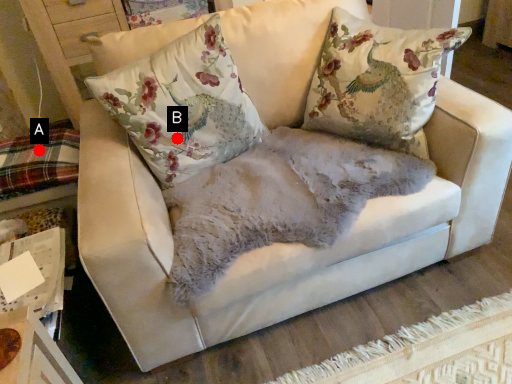
Question: Two points are circled on the image, labeled by A and B beside each circle. Which point is closer to the camera taking this photo?

Choices:
 (A) A is closer
 (B) B is closer

Answer: (B)